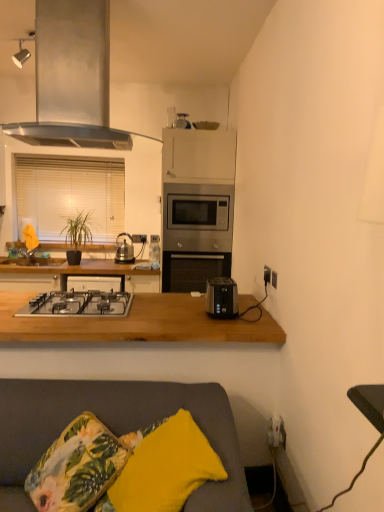
In order to face stainless steel range hood at upper left, should I rotate leftwards or rightwards?

Rotate your view left by about 15.295°.

The width and height of the screenshot is (384, 512). Describe the element at coordinates (198, 218) in the screenshot. I see `stainless steel microwave at center` at that location.

This screenshot has width=384, height=512. What do you see at coordinates (70, 194) in the screenshot?
I see `white blinds at left` at bounding box center [70, 194].

What do you see at coordinates (166, 468) in the screenshot? I see `yellow fabric pillow at lower center` at bounding box center [166, 468].

The width and height of the screenshot is (384, 512). Find the location of `yellow fabric pillow at lower center`. yellow fabric pillow at lower center is located at coordinates (166, 468).

What do you see at coordinates (114, 429) in the screenshot? This screenshot has width=384, height=512. I see `gray fabric couch at lower center` at bounding box center [114, 429].

Where is `green matte plant at center`? green matte plant at center is located at coordinates (77, 236).

Is point (150, 236) in front of point (52, 392)?

No, (150, 236) is behind (52, 392).

Would you say white plastic electrical outlet at center, positioned as the first electric outlet in left-to-right order, is outside gray fabric couch at lower center?

Yes, white plastic electrical outlet at center, positioned as the first electric outlet in left-to-right order, is not within gray fabric couch at lower center.

Considering the relative sizes of white plastic electrical outlet at center, positioned as the first electric outlet in left-to-right order, and gray fabric couch at lower center in the image provided, is white plastic electrical outlet at center, positioned as the first electric outlet in left-to-right order, wider than gray fabric couch at lower center?

In fact, white plastic electrical outlet at center, positioned as the first electric outlet in left-to-right order, might be narrower than gray fabric couch at lower center.

Considering the relative sizes of white plastic electrical outlet at center, which is counted as the 1th electric outlet, starting from the top, and gray fabric couch at lower center in the image provided, is white plastic electrical outlet at center, which is counted as the 1th electric outlet, starting from the top, shorter than gray fabric couch at lower center?

Yes.

Considering the relative sizes of green matte plant at center and floral fabric cushion at lower left in the image provided, is green matte plant at center taller than floral fabric cushion at lower left?

Yes.

Considering the positions of point (73, 258) and point (76, 438), is point (73, 258) closer or farther from the camera than point (76, 438)?

Point (73, 258).

From a real-world perspective, is green matte plant at center positioned above or below floral fabric cushion at lower left?

green matte plant at center is above floral fabric cushion at lower left.

Looking at their sizes, would you say green matte plant at center is wider or thinner than floral fabric cushion at lower left?

In the image, green matte plant at center appears to be more narrow than floral fabric cushion at lower left.

Is wooden at lower center at the left side of stainless steel range hood at upper left?

Yes, wooden at lower center is to the left of stainless steel range hood at upper left.

The width and height of the screenshot is (384, 512). I want to click on kitchen appliance that appears in front of the wooden at lower center, so click(73, 79).

From a real-world perspective, relative to stainless steel range hood at upper left, is wooden at lower center vertically above or below?

In terms of real-world spatial position, wooden at lower center is below stainless steel range hood at upper left.

Is point (138, 475) closer or farther from the camera than point (43, 312)?

Point (138, 475) is positioned closer to the camera compared to point (43, 312).

Is the surface of yellow fabric pillow at lower center in direct contact with stainless steel gas stove at center?

No, yellow fabric pillow at lower center is not touching stainless steel gas stove at center.

From the image's perspective, would you say yellow fabric pillow at lower center is shown under stainless steel gas stove at center?

Yes, from the image's perspective, yellow fabric pillow at lower center is below stainless steel gas stove at center.

Does yellow fabric pillow at lower center turn towards stainless steel gas stove at center?

No, yellow fabric pillow at lower center is not turned towards stainless steel gas stove at center.

Does white plastic electrical outlet at center, which is counted as the 1th electric outlet, starting from the top, appear on the left side of shiny metallic kettle at center, positioned as the second appliance in top-to-bottom order?

Incorrect, white plastic electrical outlet at center, which is counted as the 1th electric outlet, starting from the top, is not on the left side of shiny metallic kettle at center, positioned as the second appliance in top-to-bottom order.

Is white plastic electrical outlet at center, arranged as the first electric outlet when viewed from the back, bigger than shiny metallic kettle at center, arranged as the 1th appliance when viewed from the left?

No.

This screenshot has height=512, width=384. Identify the location of appliance on the left of white plastic electrical outlet at center, arranged as the first electric outlet when viewed from the back. point(124,250).

Is white plastic electrical outlet at center, positioned as the first electric outlet in left-to-right order, turned away from shiny metallic kettle at center, the 1th appliance in the bottom-to-top sequence?

No, shiny metallic kettle at center, the 1th appliance in the bottom-to-top sequence, is not at the back of white plastic electrical outlet at center, positioned as the first electric outlet in left-to-right order.

Between point (175, 125) and point (222, 277), which one is positioned in front?

The point (222, 277) is closer.

Which is correct: satin silver toaster at upper center, which is the second appliance in bottom-to-top order, is inside black plastic toaster at right, or outside of it?

satin silver toaster at upper center, which is the second appliance in bottom-to-top order, is spatially situated outside black plastic toaster at right.

Which object is thinner, satin silver toaster at upper center, the first appliance when ordered from top to bottom, or black plastic toaster at right?

black plastic toaster at right is thinner.

Is satin silver toaster at upper center, the first appliance when ordered from top to bottom, aimed at black plastic toaster at right?

No, satin silver toaster at upper center, the first appliance when ordered from top to bottom, is not oriented towards black plastic toaster at right.

From a real-world perspective, is black plastic socket at right, the 1th electric outlet when ordered from front to back, over stainless steel gas stove at center?

Indeed, from a real-world perspective, black plastic socket at right, the 1th electric outlet when ordered from front to back, stands above stainless steel gas stove at center.

In the scene shown: Does black plastic socket at right, which ranks as the 2th electric outlet in left-to-right order, have a greater height compared to stainless steel gas stove at center?

Correct, black plastic socket at right, which ranks as the 2th electric outlet in left-to-right order, is much taller as stainless steel gas stove at center.

Looking at this image, which is more to the left, black plastic socket at right, the 1th electric outlet when ordered from front to back, or stainless steel gas stove at center?

Positioned to the left is stainless steel gas stove at center.

Is black plastic socket at right, placed as the 2th electric outlet when sorted from top to bottom, positioned far away from stainless steel gas stove at center?

black plastic socket at right, placed as the 2th electric outlet when sorted from top to bottom, is near stainless steel gas stove at center, not far away.

You are a GUI agent. You are given a task and a screenshot of the screen. Output one action in this format:
    pyautogui.click(x=<x>, y=<y>)
    Task: Click on the 2nd electric outlet behind the gray fabric couch at lower center, counting from the anchor's position
    
    Given the screenshot: What is the action you would take?
    pyautogui.click(x=154, y=239)

This screenshot has width=384, height=512. Find the location of `houseplant above the floral fabric cushion at lower left (from a real-world perspective)`. houseplant above the floral fabric cushion at lower left (from a real-world perspective) is located at coordinates (77, 236).

Which object lies further to the anchor point floral fabric cushion at lower left, gray fabric couch at lower center or stainless steel microwave at center?

stainless steel microwave at center.

From the image, which object appears to be farther from white blinds at left, shiny metallic kettle at center, the 1th appliance in the bottom-to-top sequence, or stainless steel microwave at center?

The object further to white blinds at left is stainless steel microwave at center.

Based on their spatial positions, is green matte plant at center or satin silver toaster at upper center, which ranks as the 1th appliance in right-to-left order, further from wooden at lower center?

satin silver toaster at upper center, which ranks as the 1th appliance in right-to-left order.

Considering their positions, is wooden at lower center positioned further to shiny metallic kettle at center, the 1th appliance in the bottom-to-top sequence, than white plastic electrical outlet at center, which is counted as the 1th electric outlet, starting from the top?

Among the two, wooden at lower center is located further to shiny metallic kettle at center, the 1th appliance in the bottom-to-top sequence.

When comparing their distances from stainless steel gas stove at center, does white plastic electrical outlet at center, positioned as the first electric outlet in left-to-right order, or yellow fabric pillow at lower center seem further?

white plastic electrical outlet at center, positioned as the first electric outlet in left-to-right order, lies further to stainless steel gas stove at center than the other object.

When comparing their distances from white blinds at left, does gray fabric couch at lower center or white plastic electrical outlet at center, positioned as the first electric outlet in left-to-right order, seem closer?

white plastic electrical outlet at center, positioned as the first electric outlet in left-to-right order.

Looking at the image, which one is located closer to satin silver toaster at upper center, which ranks as the 1th appliance in right-to-left order, white blinds at left or white plastic electrical outlet at center, which is the 2th electric outlet from front to back?

Based on the image, white plastic electrical outlet at center, which is the 2th electric outlet from front to back, appears to be nearer to satin silver toaster at upper center, which ranks as the 1th appliance in right-to-left order.

From the image, which object appears to be nearer to stainless steel gas stove at center, yellow fabric pillow at lower center or shiny metallic kettle at center, positioned as the second appliance in top-to-bottom order?

The object closer to stainless steel gas stove at center is yellow fabric pillow at lower center.

Find the location of a particular element. This screenshot has width=384, height=512. houseplant positioned between black plastic socket at right, which ranks as the 1th electric outlet in right-to-left order, and white blinds at left from near to far is located at coordinates click(x=77, y=236).

The height and width of the screenshot is (512, 384). What are the coordinates of `studio couch between stainless steel gas stove at center and black plastic socket at right, the 2th electric outlet in the back-to-front sequence` in the screenshot? It's located at (114, 429).

Image resolution: width=384 pixels, height=512 pixels. What are the coordinates of `gas stove between gray fabric couch at lower center and stainless steel microwave at center in the front-back direction` in the screenshot? It's located at (80, 304).

In order to click on countertop between stainless steel range hood at upper left and green matte plant at center from front to back in this screenshot , I will do `click(73, 270)`.